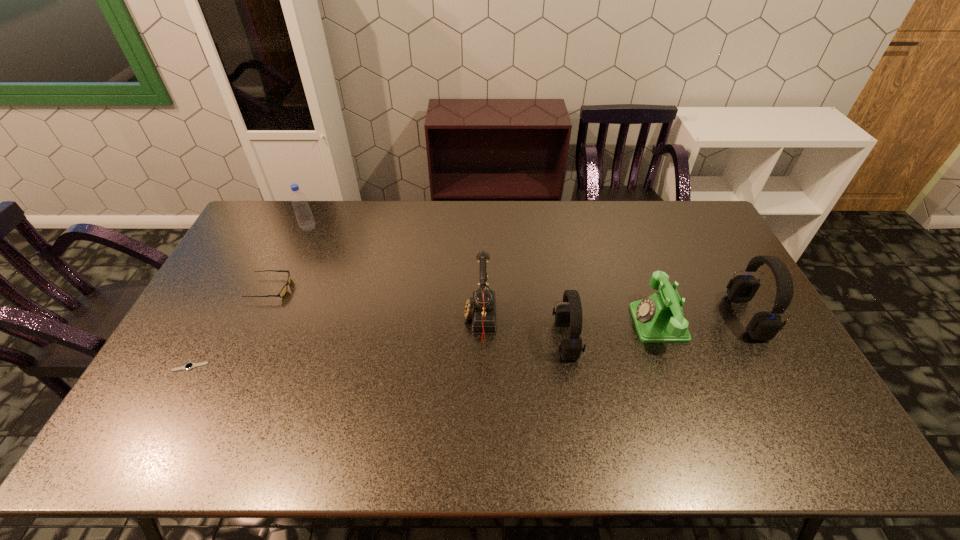
Given the evenly spaced headsets in the image, where should an extra headset be added on the left to preserve the spacing? Please point to a vacant space. Please provide its 2D coordinates. Your answer should be formatted as a tuple, i.e. [(x, y)], where the tuple contains the x and y coordinates of a point satisfying the conditions above.

[(368, 364)]